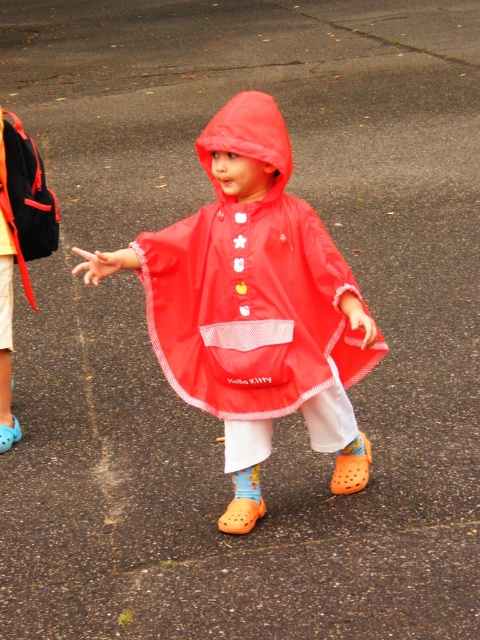
Which is above, matte red raincoat at center or matte black backpack at left?

matte black backpack at left is higher up.

Describe the element at coordinates (254, 307) in the screenshot. I see `matte red raincoat at center` at that location.

Is point (372, 364) positioned in front of point (32, 301)?

Yes, point (372, 364) is closer to viewer.

Find the location of a particular element. The width and height of the screenshot is (480, 640). matte red raincoat at center is located at coordinates (254, 307).